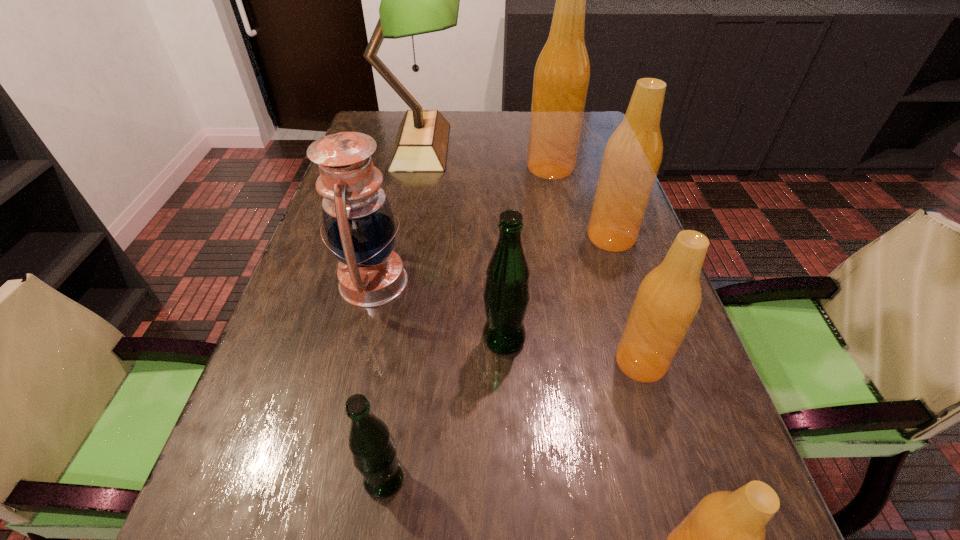
Identify the location of vacant space that's between the blue oil lamp and the second nearest object. The width and height of the screenshot is (960, 540). (379, 380).

What are the coordinates of `free spot between the table lamp and the second nearest object` in the screenshot? It's located at (402, 313).

Locate which object is the closest to the left green beer bottle. Please provide its 2D coordinates. Your answer should be formatted as a tuple, i.e. [(x, y)], where the tuple contains the x and y coordinates of a point satisfying the conditions above.

[(506, 295)]

At what (x,y) coordinates should I click in order to perform the action: click on the sixth closest object to the farthest tan beer bottle. Please return your answer as a coordinate pair (x, y). This screenshot has height=540, width=960. Looking at the image, I should click on (373, 449).

Identify the location of the third closest beer bottle to the nearest object. This screenshot has width=960, height=540. (373, 449).

Choose which beer bottle is the second nearest neighbor to the leftmost beer bottle. Please provide its 2D coordinates. Your answer should be formatted as a tuple, i.e. [(x, y)], where the tuple contains the x and y coordinates of a point satisfying the conditions above.

[(722, 539)]

Find the location of a particular element. The image size is (960, 540). tan beer bottle that is the second closest to the left green beer bottle is located at coordinates (669, 297).

Locate an element on the screen. the fourth closest tan beer bottle to the green table lamp is located at coordinates (722, 539).

What are the coordinates of `free space that satisfies the following two spatial constraints: 1. on the metallic stand of the table lamp; 2. on the left side of the left green beer bottle` in the screenshot? It's located at (357, 479).

Identify the location of free space that satisfies the following two spatial constraints: 1. on the metallic stand of the table lamp; 2. on the back side of the farthest beer bottle. This screenshot has width=960, height=540. (417, 167).